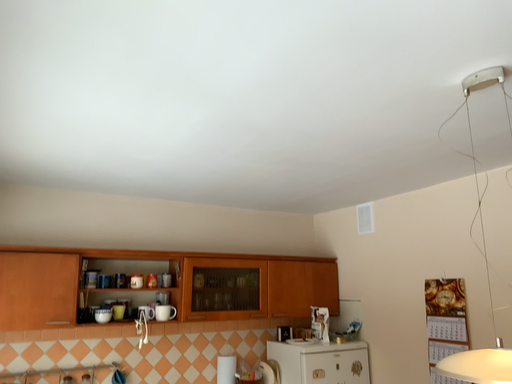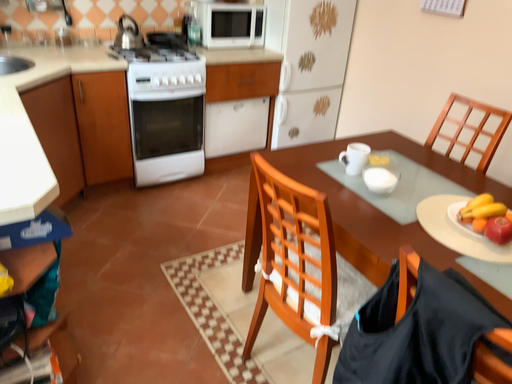
Question: Which way did the camera rotate in the video?

Choices:
 (A) rotated downward
 (B) rotated upward

Answer: (A)